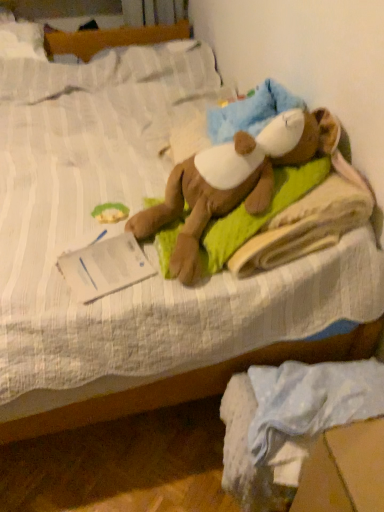
Question: Is white cotton fabric at lower right taller than soft brown plush toy at center?

Choices:
 (A) no
 (B) yes

Answer: (A)

Question: Can you confirm if white cotton fabric at lower right is bigger than soft brown plush toy at center?

Choices:
 (A) yes
 (B) no

Answer: (B)

Question: Is white cotton fabric at lower right not within soft brown plush toy at center?

Choices:
 (A) yes
 (B) no

Answer: (A)

Question: Considering the relative sizes of white cotton fabric at lower right and soft brown plush toy at center in the image provided, is white cotton fabric at lower right wider than soft brown plush toy at center?

Choices:
 (A) no
 (B) yes

Answer: (B)

Question: Does white cotton fabric at lower right contain soft brown plush toy at center?

Choices:
 (A) yes
 (B) no

Answer: (B)

Question: Is white cotton fabric at lower right to the right of soft brown plush toy at center from the viewer's perspective?

Choices:
 (A) yes
 (B) no

Answer: (A)

Question: From a real-world perspective, is green fabric at upper left positioned over white cotton fabric at lower right based on gravity?

Choices:
 (A) yes
 (B) no

Answer: (A)

Question: Is green fabric at upper left directly adjacent to white cotton fabric at lower right?

Choices:
 (A) yes
 (B) no

Answer: (B)

Question: Does green fabric at upper left appear on the left side of white cotton fabric at lower right?

Choices:
 (A) no
 (B) yes

Answer: (B)

Question: Is green fabric at upper left shorter than white cotton fabric at lower right?

Choices:
 (A) no
 (B) yes

Answer: (B)

Question: Can you confirm if green fabric at upper left is wider than white cotton fabric at lower right?

Choices:
 (A) yes
 (B) no

Answer: (B)

Question: Is green fabric at upper left taller than white cotton fabric at lower right?

Choices:
 (A) yes
 (B) no

Answer: (B)

Question: From the image's perspective, is soft brown plush toy at center beneath green fabric at upper left?

Choices:
 (A) no
 (B) yes

Answer: (A)